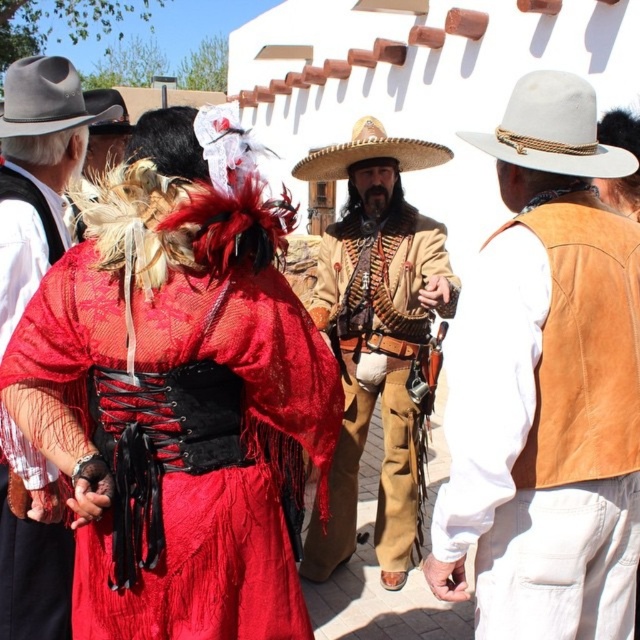
Question: Observing the image, what is the correct spatial positioning of dark brown felt cowboy hat at upper left in reference to black felt cowboy hat at upper left?

Choices:
 (A) above
 (B) below

Answer: (B)

Question: Among these points, which one is nearest to the camera?

Choices:
 (A) (20, 545)
 (B) (595, 176)
 (C) (118, 129)
 (D) (35, 88)

Answer: (B)

Question: Considering the relative positions of white felt cowboy hat at upper center and black felt cowboy hat at upper left in the image provided, where is white felt cowboy hat at upper center located with respect to black felt cowboy hat at upper left?

Choices:
 (A) below
 (B) above

Answer: (A)

Question: Which point is farther to the camera?

Choices:
 (A) (17, 518)
 (B) (531, 129)

Answer: (A)

Question: Does brown leather jacket at center lie behind strawmaterial/texturecowboy hat at center?

Choices:
 (A) no
 (B) yes

Answer: (A)

Question: Estimate the real-world distances between objects in this image. Which object is closer to the black felt cowboy hat at upper left?

Choices:
 (A) brown leather jacket at center
 (B) white felt cowboy hat at upper center
 (C) strawmaterial/texturecowboy hat at center

Answer: (C)